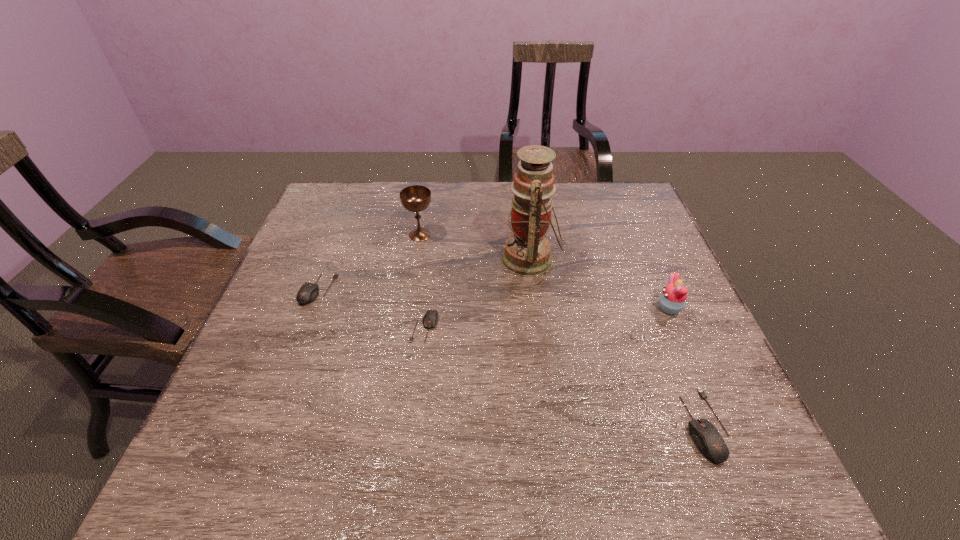
If equal spacing is desired by inserting an extra mouse_(computer_equipment) among them, please point out a free spot for this new mouse_(computer_equipment). Please provide its 2D coordinates. Your answer should be formatted as a tuple, i.e. [(x, y)], where the tuple contains the x and y coordinates of a point satisfying the conditions above.

[(551, 372)]